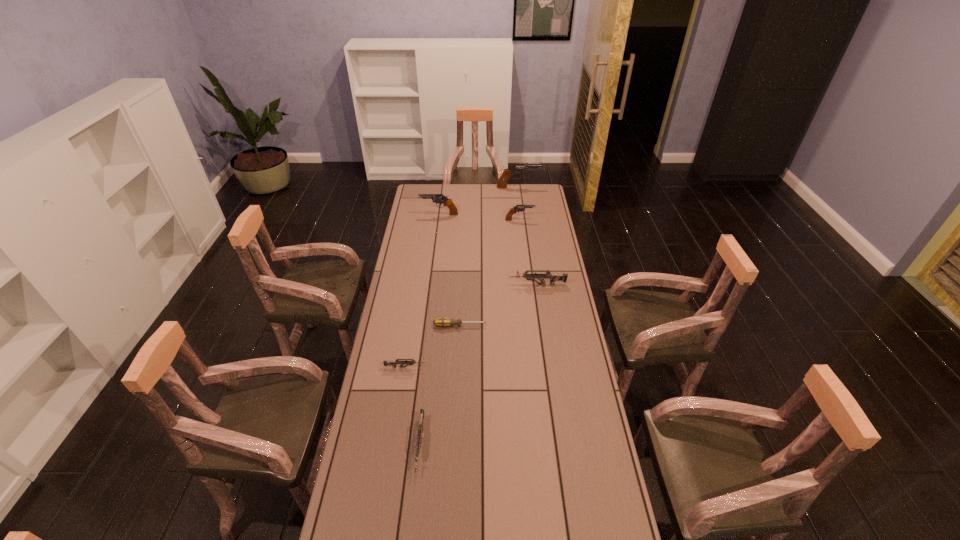
In order to click on the closest grey gun to the fourth nearest object in this screenshot , I will do `click(393, 363)`.

Locate an element on the screen. The height and width of the screenshot is (540, 960). blank space that satisfies the following two spatial constraints: 1. along the barrel of the nearest black gun; 2. aimed along the barrel of the third shortest object is located at coordinates (547, 446).

You are a GUI agent. You are given a task and a screenshot of the screen. Output one action in this format:
    pyautogui.click(x=<x>, y=<y>)
    Task: Click on the vacant space that satisfies the following two spatial constraints: 1. at the tip of the gray screwdriver; 2. aimed along the barrel of the second shortest gun
    The height and width of the screenshot is (540, 960).
    Given the screenshot: What is the action you would take?
    pyautogui.click(x=454, y=446)

In order to click on free space that satisfies the following two spatial constraints: 1. aimed along the barrel of the fourth nearest object; 2. aimed along the barrel of the third shortest object in this screenshot , I will do `click(561, 446)`.

Where is `vacant region that satisfies the following two spatial constraints: 1. along the barrel of the nearest black gun; 2. aimed along the barrel of the nearest grey gun`? This screenshot has height=540, width=960. vacant region that satisfies the following two spatial constraints: 1. along the barrel of the nearest black gun; 2. aimed along the barrel of the nearest grey gun is located at coordinates (547, 446).